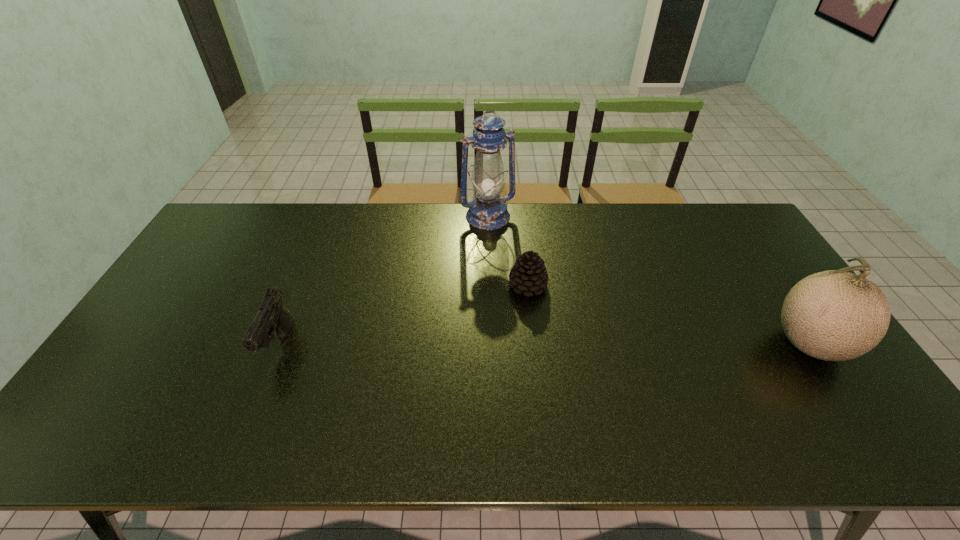
Locate an element on the screen. free space at the far left corner of the desktop is located at coordinates (223, 238).

Find the location of a particular element. The width and height of the screenshot is (960, 540). vacant region between the cantaloup and the pistol is located at coordinates 543,344.

Where is `free space between the pistol and the second tallest object`? This screenshot has width=960, height=540. free space between the pistol and the second tallest object is located at coordinates (543, 344).

This screenshot has height=540, width=960. Identify the location of vacant space in between the cantaloup and the pinecone. pos(667,314).

Locate an element on the screen. The height and width of the screenshot is (540, 960). unoccupied area between the third shortest object and the leftmost object is located at coordinates (543, 344).

The width and height of the screenshot is (960, 540). Identify the location of vacant space that's between the pinecone and the rightmost object. (667, 314).

Where is `free space that is in between the lantern and the pinecone`? This screenshot has width=960, height=540. free space that is in between the lantern and the pinecone is located at coordinates (508, 251).

Find the location of a particular element. This screenshot has width=960, height=540. empty space between the cantaloup and the pistol is located at coordinates (543, 344).

Find the location of a particular element. empty space that is in between the pistol and the cantaloup is located at coordinates (543, 344).

This screenshot has height=540, width=960. Identify the location of free point between the pistol and the pinecone. (404, 315).